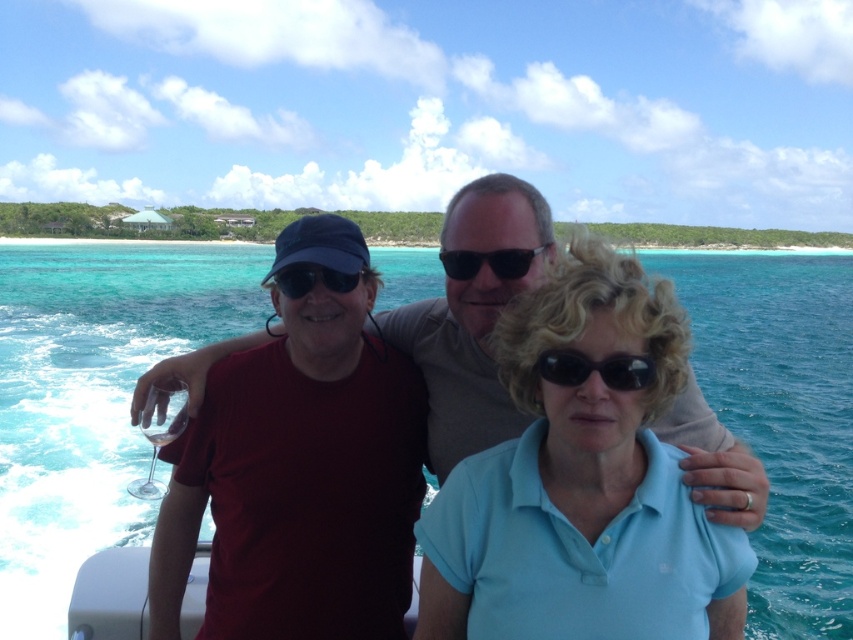
Question: Can you confirm if black reflective sunglasses at center is thinner than black plastic sunglasses at center?

Choices:
 (A) yes
 (B) no

Answer: (A)

Question: Which is nearer to the black reflective sunglasses at center?

Choices:
 (A) light blue cotton polo shirt at center
 (B) black plastic sunglasses at center
 (C) clear blue water at center
 (D) matte black goggles at center

Answer: (A)

Question: Can you confirm if black reflective sunglasses at center is positioned to the right of matte black goggles at center?

Choices:
 (A) yes
 (B) no

Answer: (A)

Question: Among these points, which one is nearest to the camera?

Choices:
 (A) (368, 340)
 (B) (289, 275)
 (C) (608, 326)
 (D) (769, 400)

Answer: (C)

Question: Is clear blue water at center above matte black goggles at center?

Choices:
 (A) yes
 (B) no

Answer: (A)

Question: Estimate the real-world distances between objects in this image. Which object is closer to the matte black goggles at center?

Choices:
 (A) black reflective sunglasses at center
 (B) light blue cotton polo shirt at center
 (C) black plastic sunglasses at center
 (D) clear blue water at center

Answer: (C)